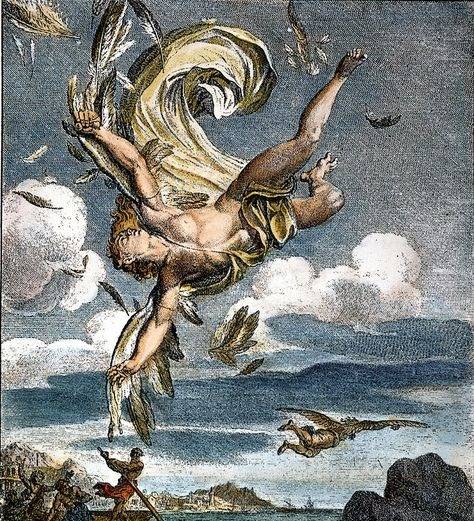
The image size is (474, 521). What are the coordinates of `chest` in the screenshot? It's located at (193, 241).